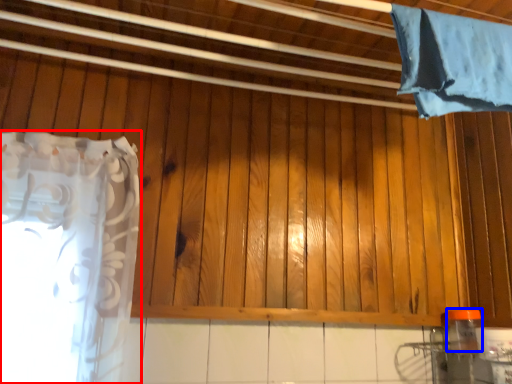
Question: Among these objects, which one is farthest to the camera, curtain (highlighted by a red box) or bottle (highlighted by a blue box)?

Choices:
 (A) curtain
 (B) bottle

Answer: (B)